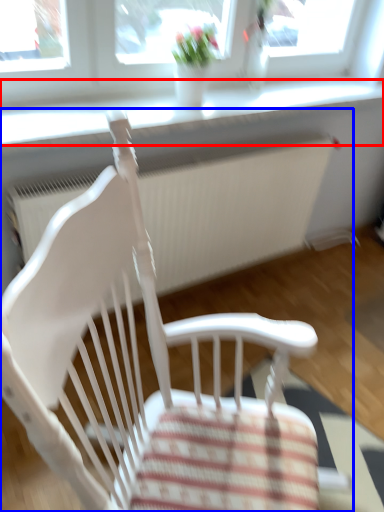
Question: Which of the following is the closest to the observer, window sill (highlighted by a red box) or chair (highlighted by a blue box)?

Choices:
 (A) window sill
 (B) chair

Answer: (B)